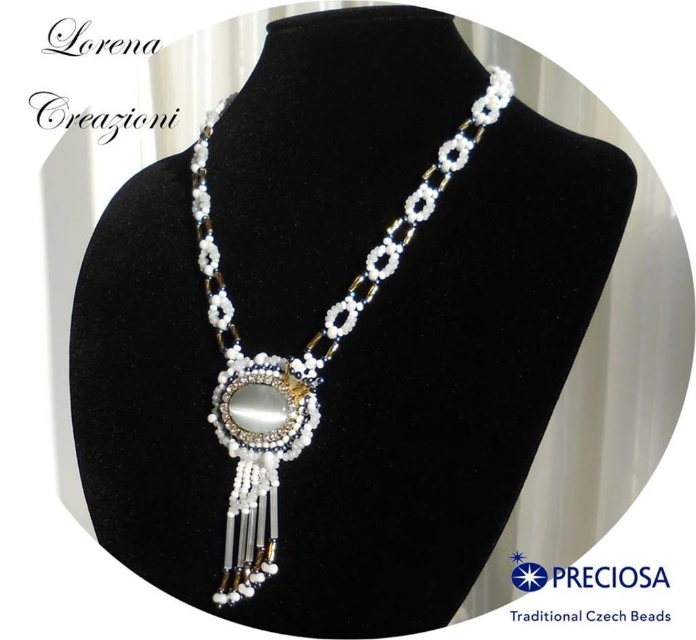
Does point (496, 115) come farther from viewer compared to point (537, 586)?

No.

Does white beaded necklace at center have a smaller size compared to white beaded pendant at center?

Incorrect, white beaded necklace at center is not smaller in size than white beaded pendant at center.

Image resolution: width=696 pixels, height=640 pixels. Identify the location of white beaded necklace at center. (296, 356).

Locate an element on the screen. This screenshot has width=696, height=640. white beaded necklace at center is located at coordinates (296, 356).